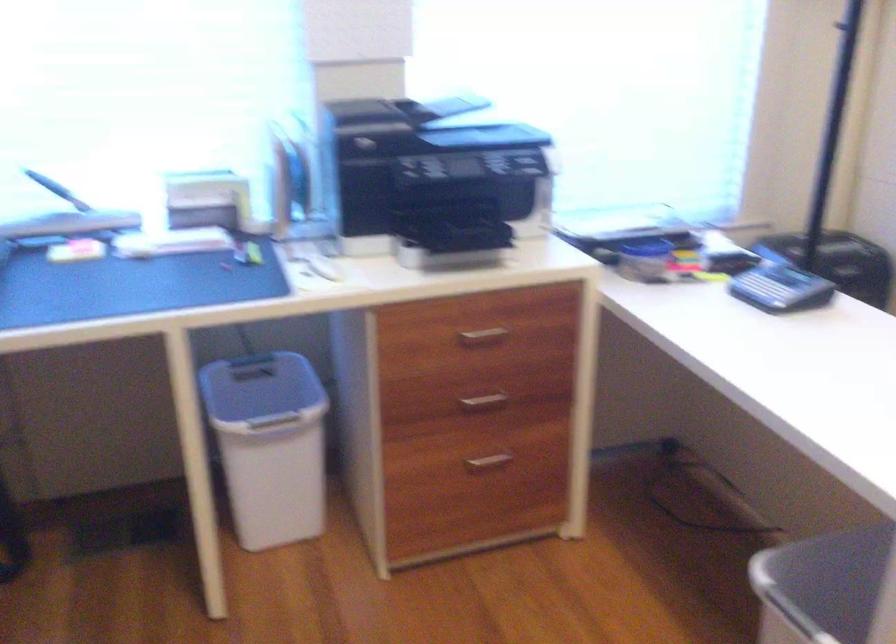
Identify the location of telephone button. The width and height of the screenshot is (896, 644). (763, 289).